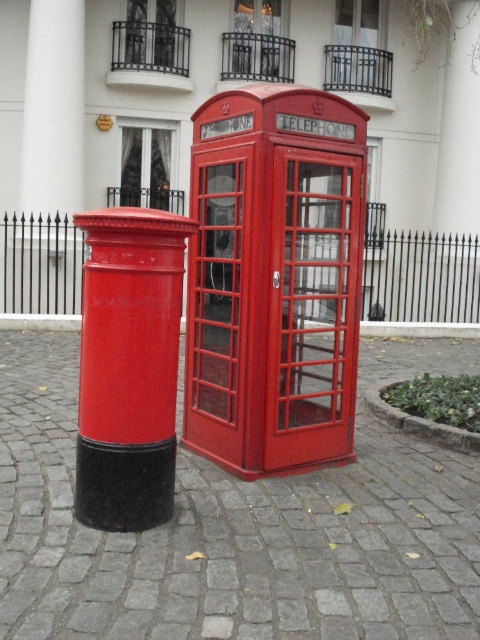
Question: Which object is the farthest from the matte red telephone box at center?

Choices:
 (A) matte red postbox at center
 (B) white glossy pillar at upper left

Answer: (B)

Question: Can you confirm if matte red telephone box at center is smaller than matte red postbox at center?

Choices:
 (A) yes
 (B) no

Answer: (B)

Question: Which point appears closest to the camera in this image?

Choices:
 (A) (132, 250)
 (B) (62, 198)

Answer: (A)

Question: Considering the relative positions of matte red telephone box at center and white glossy pillar at upper left in the image provided, where is matte red telephone box at center located with respect to white glossy pillar at upper left?

Choices:
 (A) right
 (B) left

Answer: (A)

Question: Among these points, which one is nearest to the camera?

Choices:
 (A) (190, 312)
 (B) (177, 321)

Answer: (B)

Question: Is matte red telephone box at center further to the viewer compared to matte red postbox at center?

Choices:
 (A) no
 (B) yes

Answer: (B)